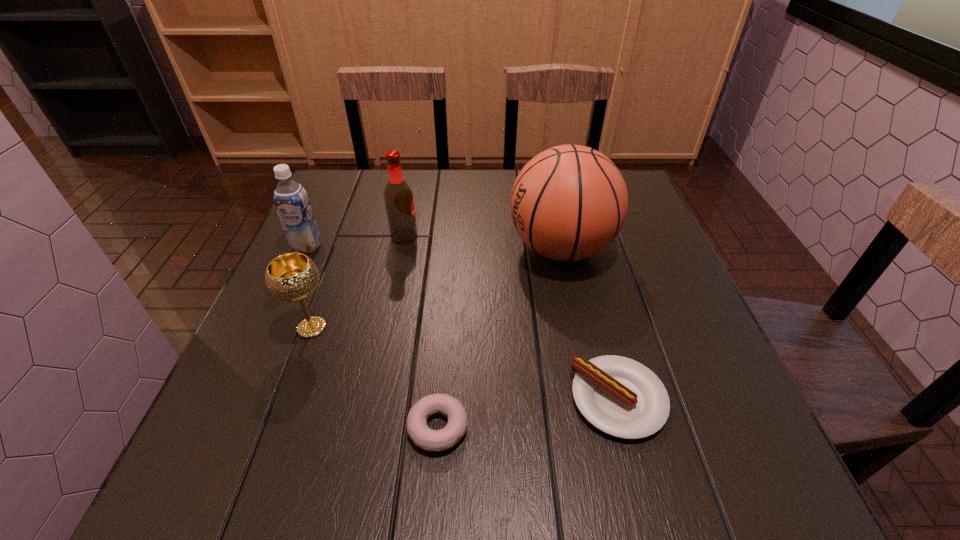
Image resolution: width=960 pixels, height=540 pixels. In order to click on basketball that is at the right edge in this screenshot , I will do `click(568, 203)`.

This screenshot has width=960, height=540. What are the coordinates of `sausage situated at the right edge` in the screenshot? It's located at (621, 397).

I want to click on object located at the near right corner, so pos(621,397).

You are a GUI agent. You are given a task and a screenshot of the screen. Output one action in this format:
    pyautogui.click(x=<x>, y=<y>)
    Task: Click on the vacant region at the far edge of the desktop
    The image size is (960, 540).
    Given the screenshot: What is the action you would take?
    pyautogui.click(x=482, y=190)

In the image, there is a desktop. Where is `free space at the near edge`? The image size is (960, 540). free space at the near edge is located at coordinates (482, 465).

The image size is (960, 540). In the image, there is a desktop. What are the coordinates of `vacant space at the left edge` in the screenshot? It's located at (296, 389).

The height and width of the screenshot is (540, 960). Identify the location of vacant space at the right edge. (717, 348).

In the image, there is a desktop. At what (x,y) coordinates should I click in order to perform the action: click on free space at the far left corner. Please return your answer as a coordinate pair (x, y). The height and width of the screenshot is (540, 960). Looking at the image, I should click on (335, 211).

Where is `free area in between the second shortest object and the soya milk`? The width and height of the screenshot is (960, 540). free area in between the second shortest object and the soya milk is located at coordinates (463, 323).

I want to click on free area in between the chalice and the basketball, so click(x=436, y=288).